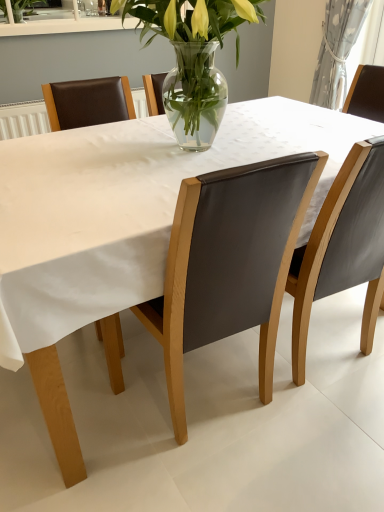
Locate an element on the screen. free point behind leather at center, the 2th chair viewed from the right is located at coordinates (206, 355).